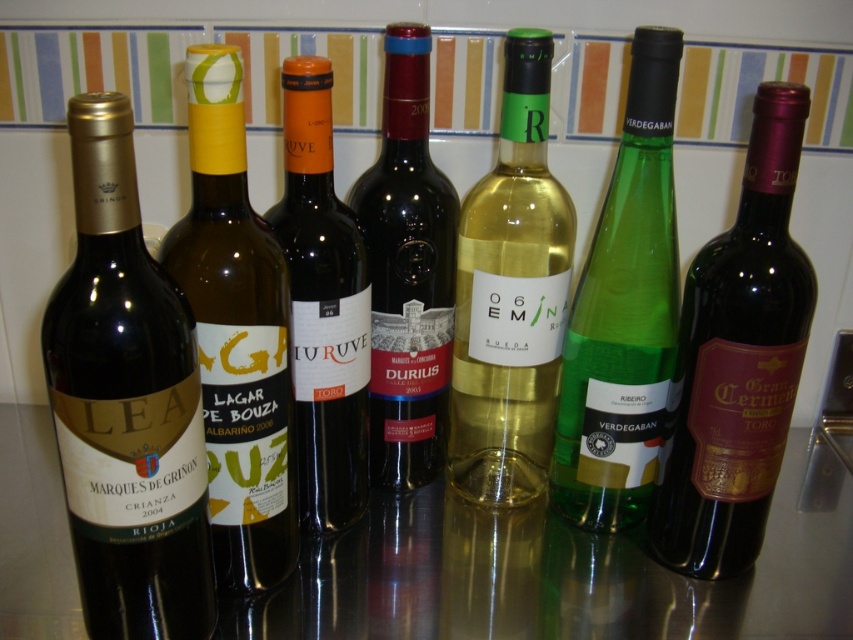
Can you confirm if matte gold wine bottle at left is wider than translucent glass wine bottle at center?

In fact, matte gold wine bottle at left might be narrower than translucent glass wine bottle at center.

This screenshot has width=853, height=640. What do you see at coordinates (126, 403) in the screenshot?
I see `matte gold wine bottle at left` at bounding box center [126, 403].

This screenshot has width=853, height=640. In order to click on matte gold wine bottle at left in this screenshot , I will do `click(126, 403)`.

From the picture: Does glossy glass table at center appear under green glass bottle at center?

Yes, glossy glass table at center is below green glass bottle at center.

Image resolution: width=853 pixels, height=640 pixels. What do you see at coordinates (561, 572) in the screenshot? I see `glossy glass table at center` at bounding box center [561, 572].

Who is more distant from viewer, (16, 586) or (634, 40)?

Point (16, 586)

At what (x,y) coordinates should I click in order to perform the action: click on glossy glass table at center. Please return your answer as a coordinate pair (x, y). The height and width of the screenshot is (640, 853). Looking at the image, I should click on (561, 572).

Does shiny dark red wine at center have a lesser width compared to green glass bottle at center?

Correct, shiny dark red wine at center's width is less than green glass bottle at center's.

Who is more forward, (781, 200) or (618, 500)?

Positioned in front is point (781, 200).

Who is more distant from viewer, (672, 509) or (637, 364)?

Positioned behind is point (672, 509).

Find the location of `shiny dark red wine at center`. shiny dark red wine at center is located at coordinates (738, 358).